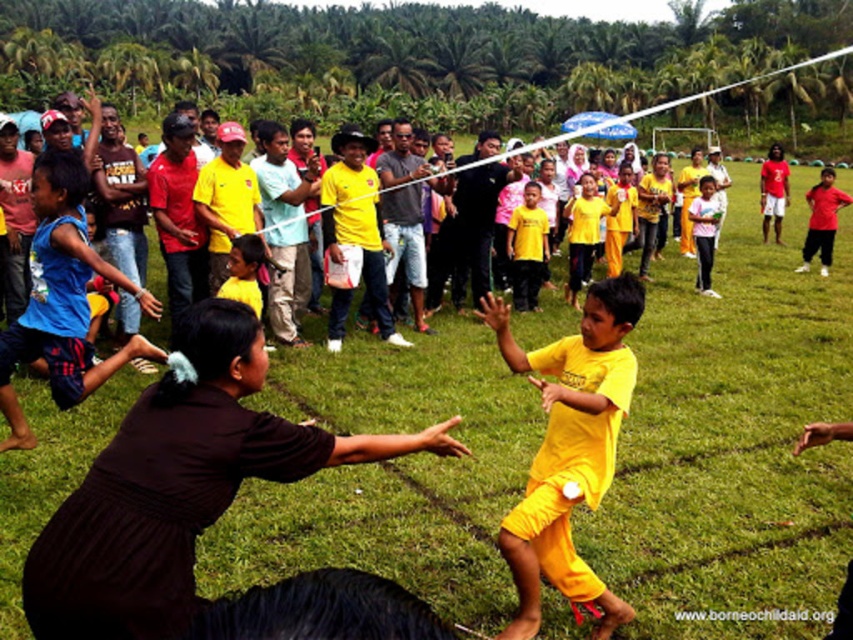
You are a photographer trying to capture the exact location of the yellow matte shorts at center in the image. According to the coordinates provided, where would you focus your camera lens to ensure the shorts are centered in the frame?

The yellow matte shorts at center are located at coordinates point (569, 449). To center them in the frame, adjust the camera lens to focus precisely on that coordinate point.

You are a photographer trying to capture a photo of both the yellow matte shorts at center and the blue fabric shorts at left. Based on their positions, which one should you focus on first to ensure both are in the frame?

The yellow matte shorts at center is positioned on the right side of blue fabric shorts at left, so you should focus on the blue fabric shorts at left first to ensure both are in the frame.